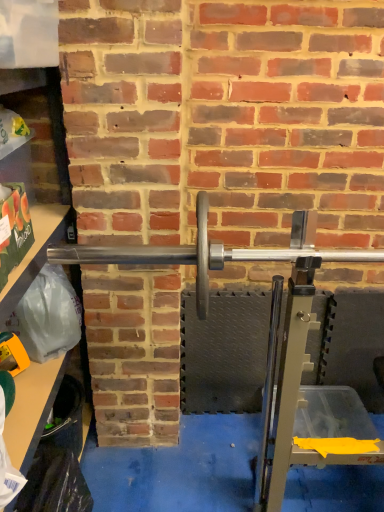
Measure the distance between silver metallic barbell at center and camera.

A distance of 35.72 inches exists between silver metallic barbell at center and camera.

Describe the element at coordinates (212, 252) in the screenshot. I see `silver metallic barbell at center` at that location.

Based on the photo, what is the approximate height of silver metallic barbell at center?

silver metallic barbell at center is 34.73 centimeters tall.

This screenshot has width=384, height=512. What are the coordinates of `silver metallic barbell at center` in the screenshot? It's located at (212, 252).

Find the location of a particular element. clear plastic bag at left is located at coordinates (38, 135).

The height and width of the screenshot is (512, 384). Describe the element at coordinates (38, 135) in the screenshot. I see `clear plastic bag at left` at that location.

Identify the location of silver metallic barbell at center. (212, 252).

Which is more to the right, silver metallic barbell at center or clear plastic bag at left?

From the viewer's perspective, silver metallic barbell at center appears more on the right side.

Is the position of silver metallic barbell at center more distant than that of clear plastic bag at left?

Yes, the depth of silver metallic barbell at center is greater than that of clear plastic bag at left.

Does point (197, 298) come farther from viewer compared to point (55, 99)?

No, (197, 298) is in front of (55, 99).

From the image's perspective, relative to clear plastic bag at left, is silver metallic barbell at center above or below?

From the image's perspective, silver metallic barbell at center appears above clear plastic bag at left.

From a real-world perspective, which object rests below the other?

clear plastic bag at left is physically lower.

Which object is wider, silver metallic barbell at center or clear plastic bag at left?

Wider between the two is clear plastic bag at left.

Considering the sizes of objects silver metallic barbell at center and clear plastic bag at left in the image provided, who is taller, silver metallic barbell at center or clear plastic bag at left?

clear plastic bag at left is taller.

Looking at the image, does silver metallic barbell at center seem bigger or smaller compared to clear plastic bag at left?

silver metallic barbell at center is smaller than clear plastic bag at left.

From the picture: Is clear plastic bag at left inside silver metallic barbell at center?

No, silver metallic barbell at center does not contain clear plastic bag at left.

Is silver metallic barbell at center positioned far away from clear plastic bag at left?

That's not correct — silver metallic barbell at center is a little close to clear plastic bag at left.

From the picture: Is silver metallic barbell at center oriented towards clear plastic bag at left?

No, silver metallic barbell at center is not facing towards clear plastic bag at left.

What's the angular difference between silver metallic barbell at center and clear plastic bag at left's facing directions?

The angular difference between silver metallic barbell at center and clear plastic bag at left is 88.6 degrees.

Where is `barbell located behind the clear plastic bag at left`? This screenshot has width=384, height=512. barbell located behind the clear plastic bag at left is located at coordinates [x=212, y=252].

Would you say clear plastic bag at left is to the left or to the right of silver metallic barbell at center in the picture?

In the image, clear plastic bag at left appears on the left side of silver metallic barbell at center.

Is the depth of clear plastic bag at left greater than that of silver metallic barbell at center?

No, it is not.

Considering the points (38, 166) and (319, 256), which point is in front, point (38, 166) or point (319, 256)?

The point (319, 256) is more forward.

From the image's perspective, is clear plastic bag at left over silver metallic barbell at center?

Incorrect, from the image's perspective, clear plastic bag at left is lower than silver metallic barbell at center.

From a real-world perspective, which object rests below the other?

In real-world perspective, clear plastic bag at left is lower.

Is clear plastic bag at left thinner than silver metallic barbell at center?

Incorrect, the width of clear plastic bag at left is not less than that of silver metallic barbell at center.

Can you confirm if clear plastic bag at left is taller than silver metallic barbell at center?

Yes.

Considering the relative sizes of clear plastic bag at left and silver metallic barbell at center in the image provided, is clear plastic bag at left smaller than silver metallic barbell at center?

Incorrect, clear plastic bag at left is not smaller in size than silver metallic barbell at center.

Would you say silver metallic barbell at center is part of clear plastic bag at left's contents?

No.

Is clear plastic bag at left with silver metallic barbell at center?

There is a gap between clear plastic bag at left and silver metallic barbell at center.

Is clear plastic bag at left oriented towards silver metallic barbell at center?

Yes, clear plastic bag at left is turned towards silver metallic barbell at center.

How different are the orientations of clear plastic bag at left and silver metallic barbell at center in degrees?

88.6 degrees.

Find the location of a particular element. The image size is (384, 512). shelf below the silver metallic barbell at center (from the image's perspective) is located at coordinates (38, 135).

Locate an element on the screen. This screenshot has width=384, height=512. shelf that appears below the silver metallic barbell at center (from a real-world perspective) is located at coordinates (38, 135).

This screenshot has width=384, height=512. I want to click on barbell that is behind the clear plastic bag at left, so click(x=212, y=252).